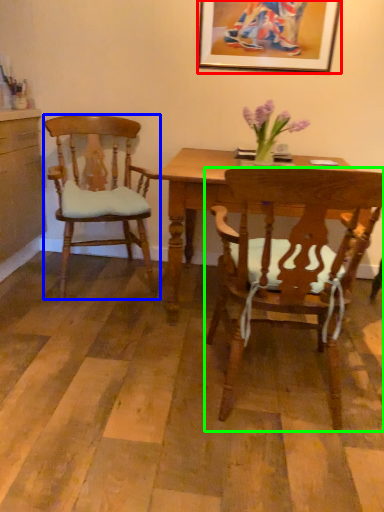
Question: Based on their relative distances, which object is farther from picture frame (highlighted by a red box)? Choose from chair (highlighted by a blue box) and chair (highlighted by a green box).

Choices:
 (A) chair
 (B) chair

Answer: (B)